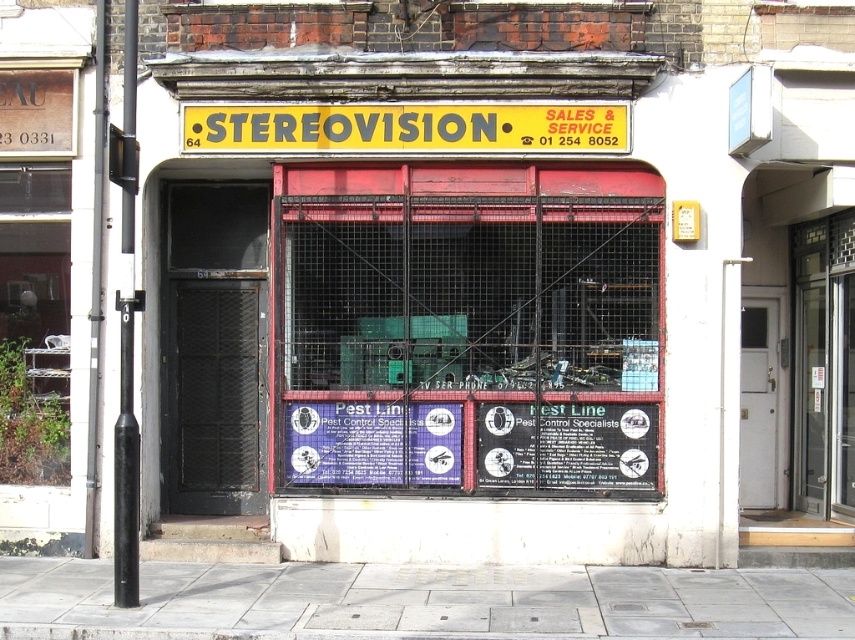
You are a delivery person trying to deliver a package to the address at the center of the image. The package is 1.2 meters wide. The delivery requires that the package must fit through the space between the metal mesh cage at center and the black matte sign at center. Can the package fit through that space?

The metal mesh cage at center might be wider than black matte sign at center, so the space between them may be insufficient for the 1.2 meter wide package to pass through. It is uncertain and requires on site measurement.

In the scene shown: You are standing in front of the STEREOVISION store. There is a point marked at coordinates (405, 129). What object is located at that point?

The point at coordinates (405, 129) marks the yellow plastic sign at center.

You are a customer looking for the StereoVision store. You see the yellow plastic sign at center and the blue paper sign at center. Which one is bigger?

The yellow plastic sign at center is bigger than the blue paper sign at center.